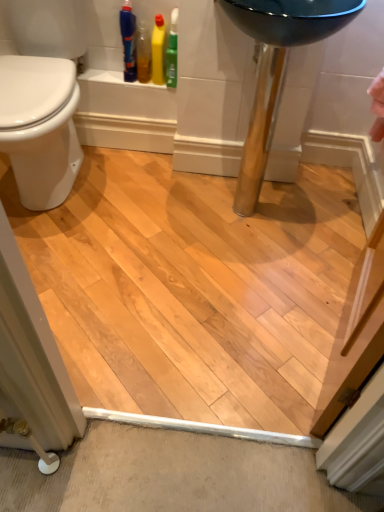
Question: Is yellow glossy bottle at upper left, marked as the 1th cleaning product in a right-to-left arrangement, touching blue plastic bottle at upper left?

Choices:
 (A) no
 (B) yes

Answer: (A)

Question: Are yellow glossy bottle at upper left, placed as the 2th cleaning product when sorted from left to right, and blue plastic bottle at upper left far apart?

Choices:
 (A) no
 (B) yes

Answer: (A)

Question: Can you confirm if yellow glossy bottle at upper left, marked as the 1th cleaning product in a right-to-left arrangement, is thinner than blue plastic bottle at upper left?

Choices:
 (A) yes
 (B) no

Answer: (A)

Question: Considering the relative sizes of yellow glossy bottle at upper left, marked as the 1th cleaning product in a right-to-left arrangement, and blue plastic bottle at upper left in the image provided, is yellow glossy bottle at upper left, marked as the 1th cleaning product in a right-to-left arrangement, shorter than blue plastic bottle at upper left?

Choices:
 (A) yes
 (B) no

Answer: (A)

Question: Considering the relative sizes of yellow glossy bottle at upper left, marked as the 1th cleaning product in a right-to-left arrangement, and blue plastic bottle at upper left in the image provided, is yellow glossy bottle at upper left, marked as the 1th cleaning product in a right-to-left arrangement, wider than blue plastic bottle at upper left?

Choices:
 (A) yes
 (B) no

Answer: (B)

Question: Is blue plastic bottle at upper left bigger or smaller than white glossy bidet at left?

Choices:
 (A) big
 (B) small

Answer: (B)

Question: Is point (124, 49) positioned closer to the camera than point (21, 144)?

Choices:
 (A) farther
 (B) closer

Answer: (A)

Question: From the image's perspective, relative to white glossy bidet at left, is blue plastic bottle at upper left above or below?

Choices:
 (A) below
 (B) above

Answer: (B)

Question: Is blue plastic bottle at upper left inside the boundaries of white glossy bidet at left, or outside?

Choices:
 (A) inside
 (B) outside

Answer: (B)

Question: Considering the positions of yellow glossy bottle at upper left, placed as the 2th cleaning product when sorted from left to right, and white glossy bidet at left in the image, is yellow glossy bottle at upper left, placed as the 2th cleaning product when sorted from left to right, wider or thinner than white glossy bidet at left?

Choices:
 (A) thin
 (B) wide

Answer: (A)

Question: In the image, is yellow glossy bottle at upper left, placed as the 2th cleaning product when sorted from left to right, on the left side or the right side of white glossy bidet at left?

Choices:
 (A) left
 (B) right

Answer: (B)

Question: Is yellow glossy bottle at upper left, placed as the 2th cleaning product when sorted from left to right, inside or outside of white glossy bidet at left?

Choices:
 (A) inside
 (B) outside

Answer: (B)

Question: Is point (163, 26) positioned closer to the camera than point (26, 129)?

Choices:
 (A) closer
 (B) farther

Answer: (B)

Question: Is white glossy bidet at left inside or outside of blue plastic bottle at upper left?

Choices:
 (A) inside
 (B) outside

Answer: (B)

Question: Is white glossy bidet at left to the left or to the right of blue plastic bottle at upper left in the image?

Choices:
 (A) right
 (B) left

Answer: (B)